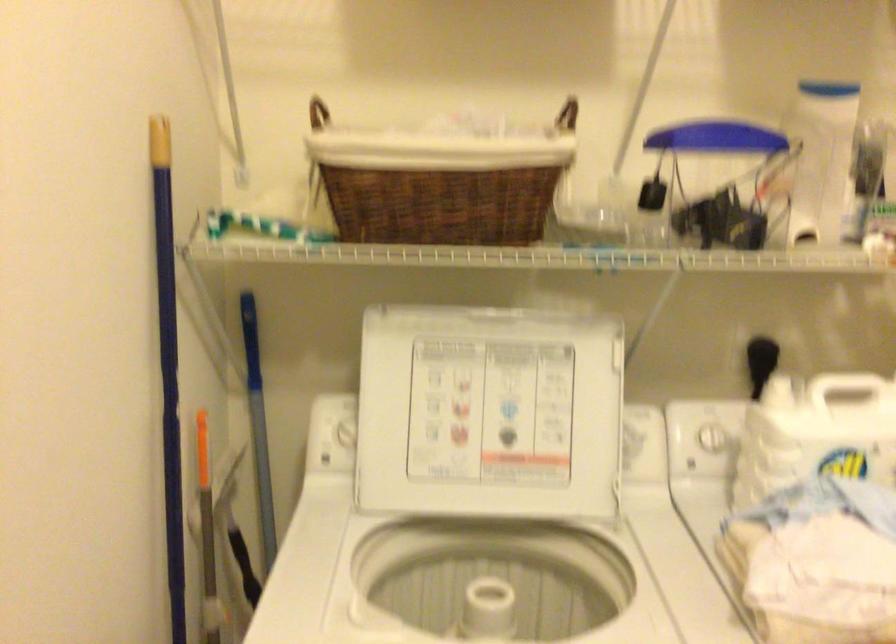
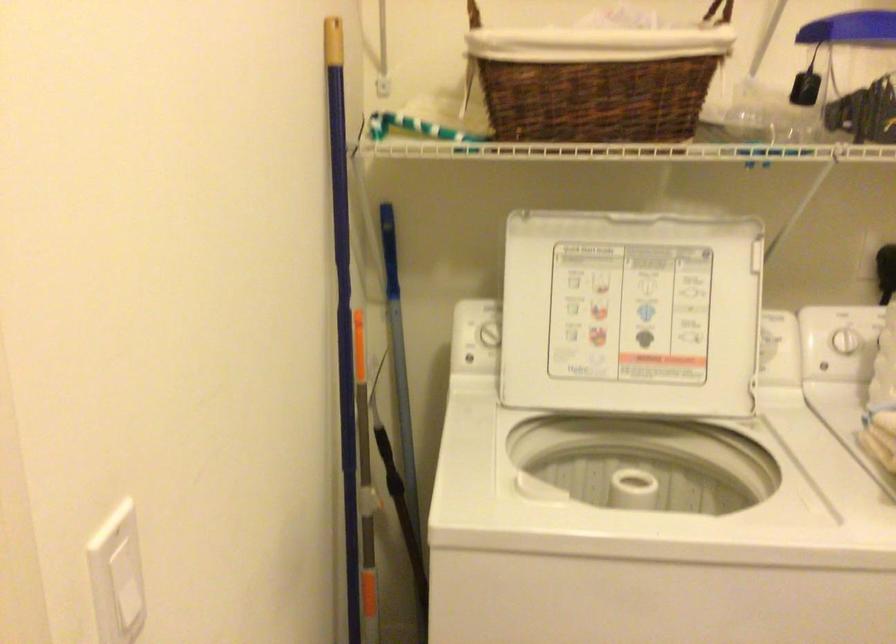
The point at (441, 180) is marked in the first image. Where is the corresponding point in the second image?

(597, 79)